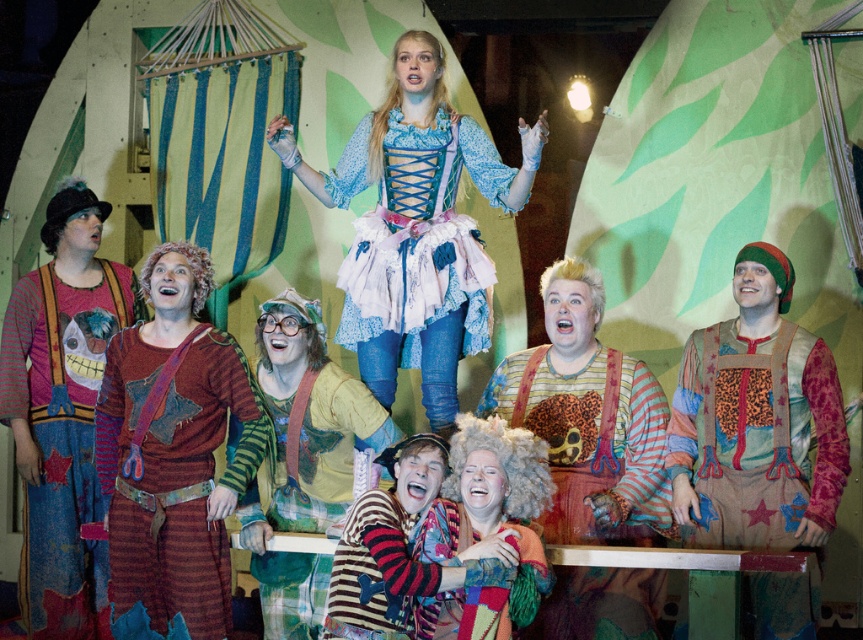
Question: Can you confirm if striped fabric apron at center is wider than matte blue dress at center?

Choices:
 (A) no
 (B) yes

Answer: (A)

Question: Which point is farther from the camera taking this photo?

Choices:
 (A) (194, 540)
 (B) (646, 506)
 (C) (817, 486)

Answer: (B)

Question: Among these objects, which one is farthest from the camera?

Choices:
 (A) striped fabric apron at center
 (B) leopard print fabric overalls at right
 (C) knitted sweater at center
 (D) matte blue dress at center

Answer: (C)

Question: Is striped woolen tunic at left to the left of knitted sweater at center from the viewer's perspective?

Choices:
 (A) yes
 (B) no

Answer: (A)

Question: Which point appears farthest from the camera in this image?

Choices:
 (A) (561, 529)
 (B) (131, 577)
 (C) (476, 564)
 (D) (427, 38)

Answer: (D)

Question: Does leopard print fabric overalls at right appear over striped knit sweater at lower center?

Choices:
 (A) no
 (B) yes

Answer: (B)